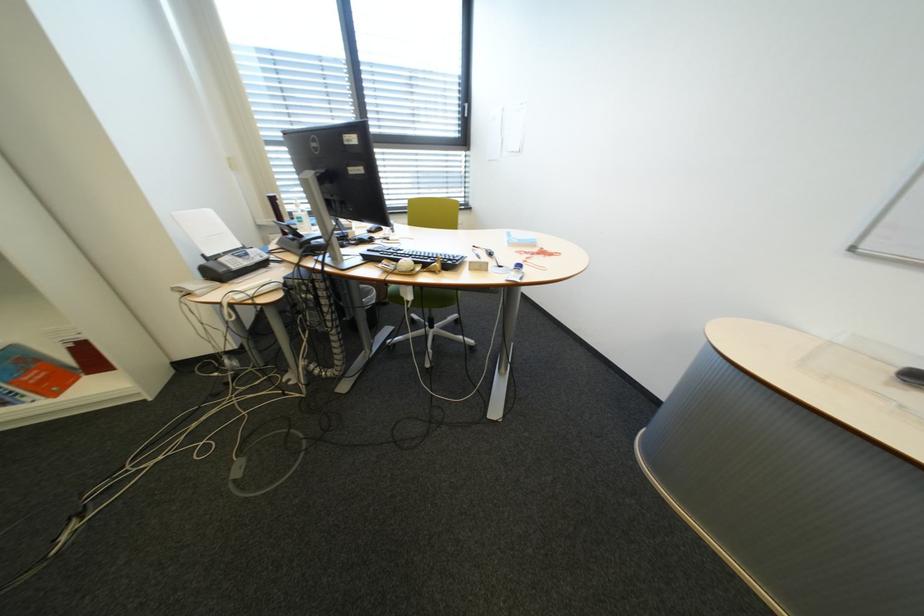
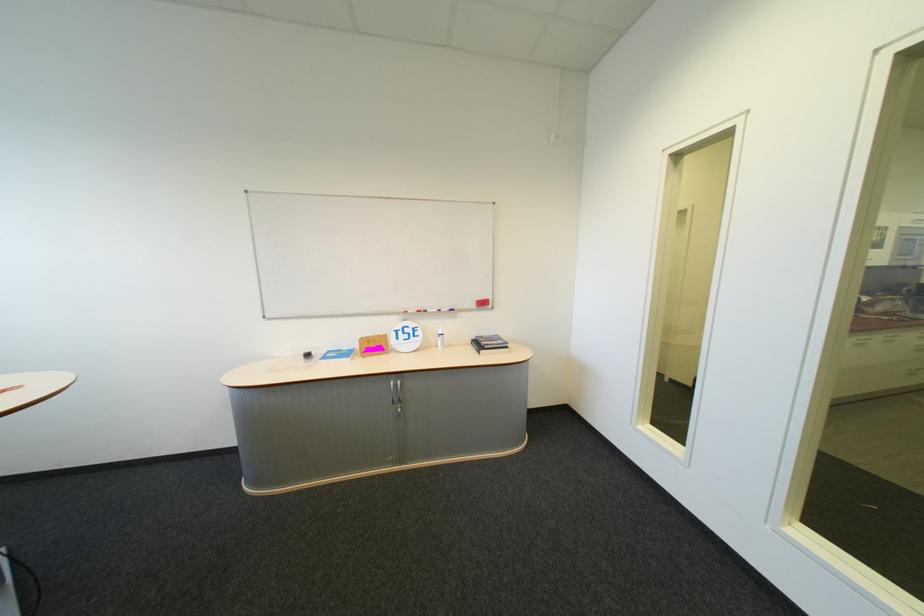
Question: Based on the continuous images, in which direction is the camera rotating? Reply with the corresponding letter.

Choices:
 (A) Left
 (B) Right
 (C) Up
 (D) Down

Answer: (B)